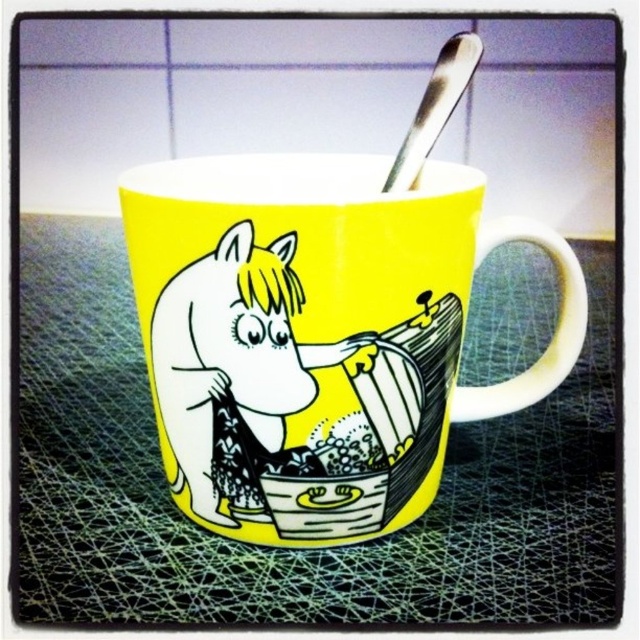
Question: Among these objects, which one is farthest from the camera?

Choices:
 (A) yellow ceramic mug at center
 (B) matte yellow horse at center

Answer: (B)

Question: Is yellow ceramic mug at center behind matte yellow horse at center?

Choices:
 (A) yes
 (B) no

Answer: (B)

Question: Does yellow ceramic mug at center have a lesser width compared to matte yellow horse at center?

Choices:
 (A) no
 (B) yes

Answer: (A)

Question: Is yellow ceramic mug at center thinner than matte yellow horse at center?

Choices:
 (A) yes
 (B) no

Answer: (B)

Question: Which of the following is the farthest from the observer?

Choices:
 (A) yellow ceramic mug at center
 (B) matte yellow horse at center

Answer: (B)

Question: Which point is farther to the camera?

Choices:
 (A) (385, 284)
 (B) (180, 362)

Answer: (B)